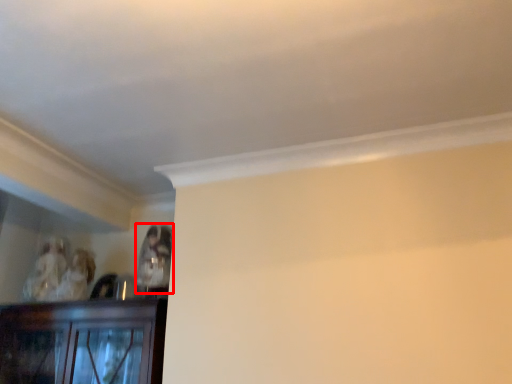
Question: From the image, what is the correct spatial relationship of person (annotated by the red box) in relation to person?

Choices:
 (A) right
 (B) left

Answer: (A)